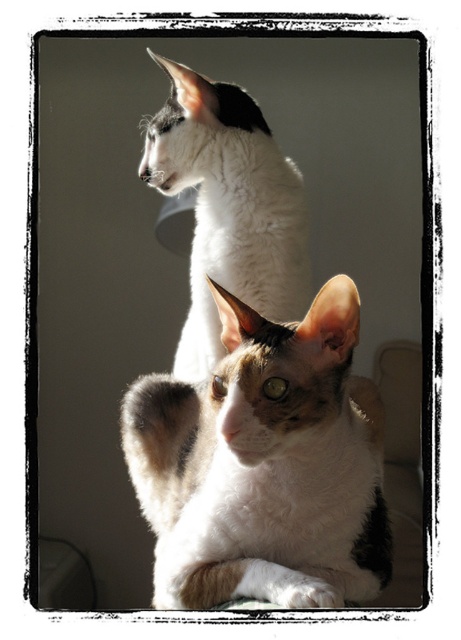
You are a photographer trying to capture both cats in the scene. Since the calico fur cat at center and white fur cat at upper center are positioned in a way that one might block the other, which cat should you adjust to ensure both are fully visible in the photo?

The calico fur cat at center is located below the white fur cat at upper center. To ensure both are fully visible, you should adjust the calico fur cat at center to move it out of the lower position or the white fur cat at upper center to move it out of the upper position so they are not overlapping vertically.

You are a photographer trying to capture both cats in a single frame. The calico fur cat at center is located at point (x=265, y=465). Can you determine if the calico fur cat at center is positioned to the left or right of the white and brown cat in the foreground?

The calico fur cat at center is located at point (x=265, y=465). Since the white and brown cat in the foreground is not mentioned in the Objects Description, we cannot determine its exact coordinates. Therefore, it is impossible to determine the relative position between the two cats based on the provided information.